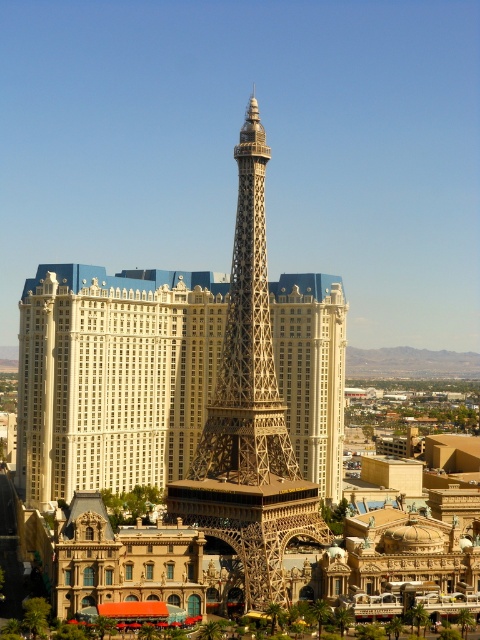
Question: Which object appears farthest from the camera in this image?

Choices:
 (A) gold metallic eiffel tower at center
 (B) metallic gold eiffel tower at center

Answer: (A)

Question: Is gold metallic eiffel tower at center below metallic gold eiffel tower at center?

Choices:
 (A) yes
 (B) no

Answer: (B)

Question: Is gold metallic eiffel tower at center wider than metallic gold eiffel tower at center?

Choices:
 (A) yes
 (B) no

Answer: (A)

Question: Which point appears farthest from the camera in this image?

Choices:
 (A) (205, 385)
 (B) (224, 506)

Answer: (A)

Question: Does gold metallic eiffel tower at center have a lesser width compared to metallic gold eiffel tower at center?

Choices:
 (A) no
 (B) yes

Answer: (A)